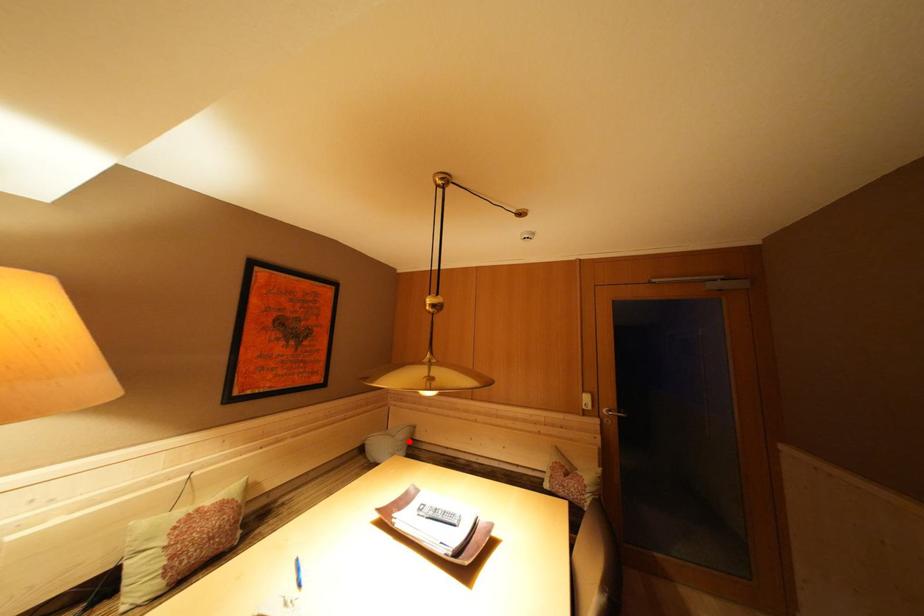
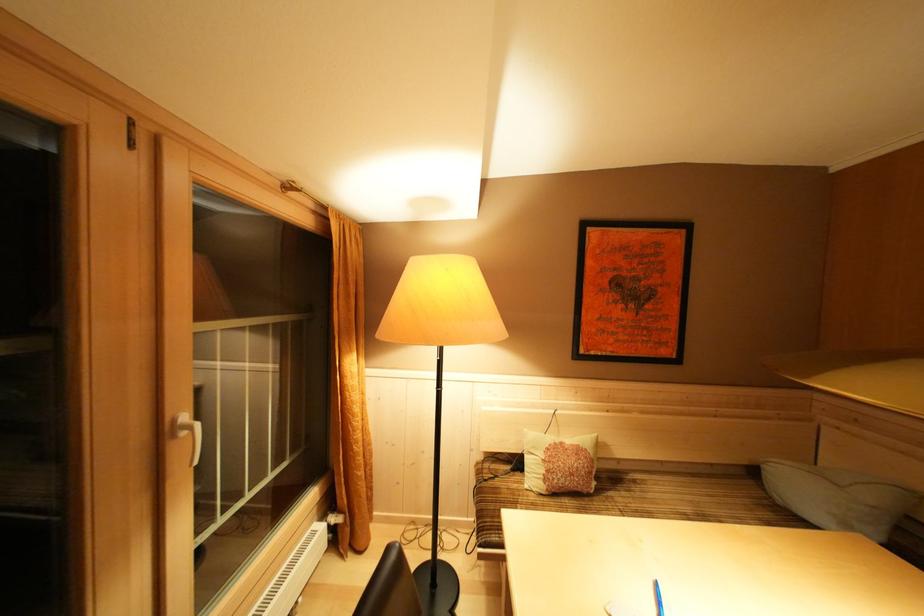
Where in the second image is the point corresponding to the highlighted location from the first image?

(879, 503)